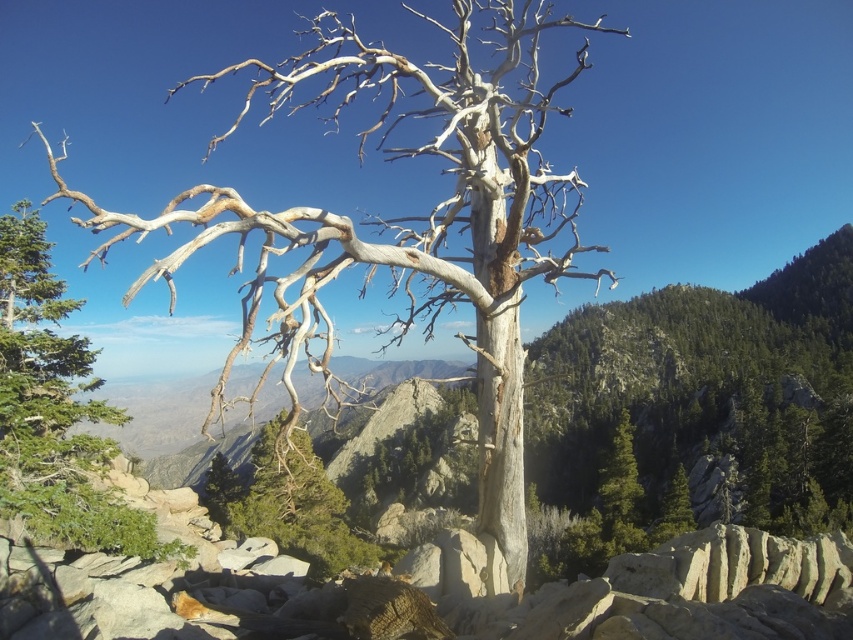
Question: Does gray bark tree at center appear on the right side of gray bark tree at upper left?

Choices:
 (A) yes
 (B) no

Answer: (B)

Question: Which point appears closest to the camera in this image?

Choices:
 (A) (354, 547)
 (B) (44, 262)
 (C) (415, 109)

Answer: (B)

Question: Is the position of gray bark tree at center more distant than that of gray bark tree at upper left?

Choices:
 (A) no
 (B) yes

Answer: (A)

Question: Estimate the real-world distances between objects in this image. Which object is closer to the green textured pine tree at center?

Choices:
 (A) gray bark tree at center
 (B) gray bark tree at upper left

Answer: (B)

Question: Which of the following is the farthest from the observer?

Choices:
 (A) gray bark tree at center
 (B) green textured pine tree at center
 (C) gray bark tree at upper left

Answer: (C)

Question: Considering the relative positions of gray bark tree at upper left and green textured pine tree at center in the image provided, where is gray bark tree at upper left located with respect to green textured pine tree at center?

Choices:
 (A) left
 (B) right

Answer: (A)